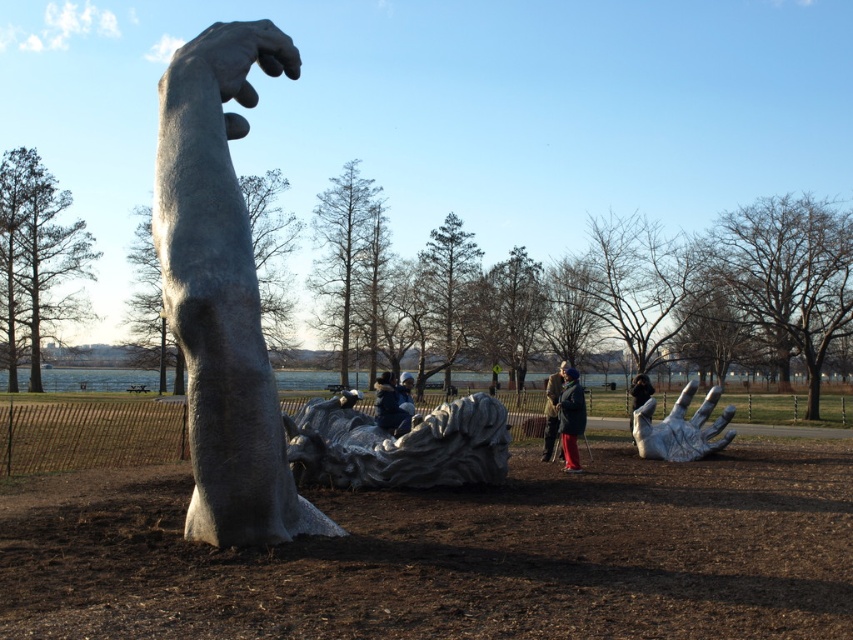
Is polished stone hand at center taller than sanded stone hand at upper center?

Correct, polished stone hand at center is much taller as sanded stone hand at upper center.

Image resolution: width=853 pixels, height=640 pixels. What are the coordinates of `polished stone hand at center` in the screenshot? It's located at (222, 291).

At what (x,y) coordinates should I click in order to perform the action: click on polished stone hand at center. Please return your answer as a coordinate pair (x, y). This screenshot has width=853, height=640. Looking at the image, I should click on point(222,291).

Between blue denim jacket at center and black fabric jacket at lower right, which one has more height?

With more height is black fabric jacket at lower right.

Who is positioned more to the left, blue denim jacket at center or black fabric jacket at lower right?

From the viewer's perspective, blue denim jacket at center appears more on the left side.

Between point (390, 428) and point (648, 392), which one is positioned in front?

Point (390, 428)

The image size is (853, 640). I want to click on blue denim jacket at center, so click(390, 406).

Does polished stone sculpture at center appear on the left side of black fabric jacket at lower right?

Correct, you'll find polished stone sculpture at center to the left of black fabric jacket at lower right.

Does point (757, 464) come farther from viewer compared to point (635, 403)?

No, (757, 464) is closer to viewer.

What are the coordinates of `polished stone sculpture at center` in the screenshot? It's located at (454, 554).